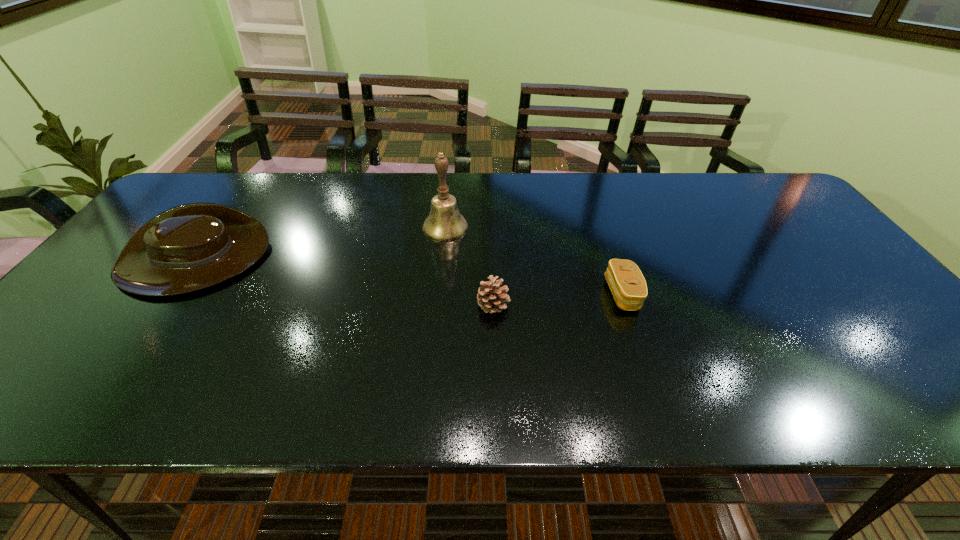
This screenshot has width=960, height=540. I want to click on empty location between the rightmost object and the bell, so click(x=534, y=261).

Where is `unoccupied area between the second object from right to left and the bell`? This screenshot has width=960, height=540. unoccupied area between the second object from right to left and the bell is located at coordinates (469, 266).

At what (x,y) coordinates should I click in order to perform the action: click on free space between the pinecone and the cowboy hat. Please return your answer as a coordinate pair (x, y). This screenshot has width=960, height=540. Looking at the image, I should click on (343, 282).

In order to click on vacant space that is in between the second object from right to left and the leftmost object in this screenshot , I will do `click(343, 282)`.

Locate an element on the screen. Image resolution: width=960 pixels, height=540 pixels. free space between the shortest object and the cowboy hat is located at coordinates [x=407, y=277].

Locate an element on the screen. The height and width of the screenshot is (540, 960). free space between the pinecone and the rightmost object is located at coordinates (558, 300).

You are a GUI agent. You are given a task and a screenshot of the screen. Output one action in this format:
    pyautogui.click(x=<x>, y=<y>)
    Task: Click on the vacant point located between the third object from left to right and the leftmost object
    
    Given the screenshot: What is the action you would take?
    pyautogui.click(x=343, y=282)

This screenshot has width=960, height=540. I want to click on vacant area that lies between the pinecone and the shortest object, so click(x=558, y=300).

The height and width of the screenshot is (540, 960). I want to click on object that stands as the third closest to the pinecone, so click(x=190, y=247).

Locate an element on the screen. object that stands as the closest to the second object from left to right is located at coordinates click(491, 298).